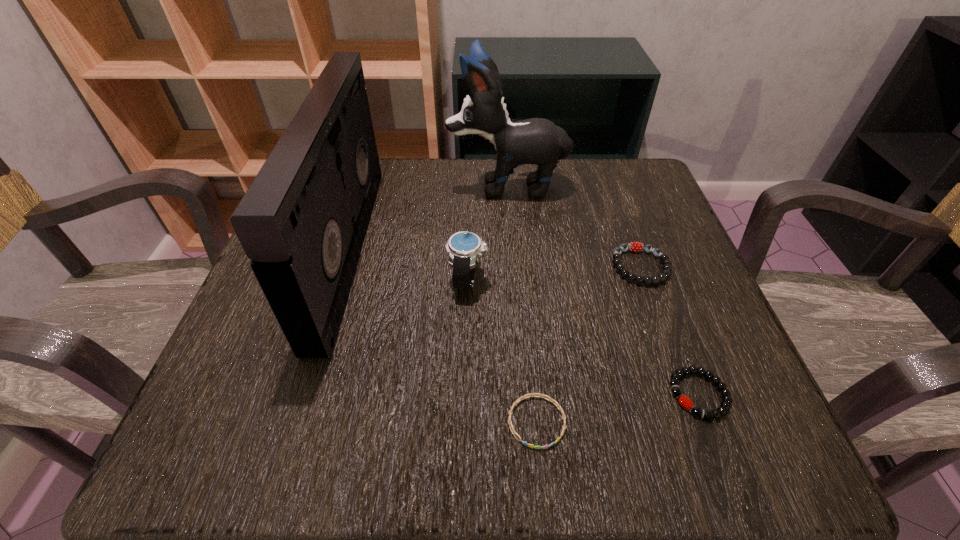
Image resolution: width=960 pixels, height=540 pixels. I want to click on free space between the puppy and the videotape, so click(428, 218).

Locate an element on the screen. Image resolution: width=960 pixels, height=540 pixels. free space between the puppy and the watch is located at coordinates (488, 232).

This screenshot has height=540, width=960. I want to click on free space between the watch and the shortest object, so (x=502, y=350).

Where is `vacant space that is in between the tallest bracelet and the watch`? The image size is (960, 540). vacant space that is in between the tallest bracelet and the watch is located at coordinates (554, 273).

At what (x,y) coordinates should I click in order to perform the action: click on unoccupied position between the tallest bracelet and the watch. Please return your answer as a coordinate pair (x, y). Looking at the image, I should click on (554, 273).

You are a GUI agent. You are given a task and a screenshot of the screen. Output one action in this format:
    pyautogui.click(x=<x>, y=<y>)
    Task: Click on the object that stands as the second closest to the videotape
    
    Given the screenshot: What is the action you would take?
    pyautogui.click(x=463, y=248)

Identify the location of object that is the third nearest to the farthest bracelet. (463, 248).

Select which bracelet appears as the second closest to the second shortest object. Please provide its 2D coordinates. Your answer should be formatted as a tuple, i.e. [(x, y)], where the tuple contains the x and y coordinates of a point satisfying the conditions above.

[(664, 258)]

Where is `bracelet that is the second closest to the leftmost bracelet`? bracelet that is the second closest to the leftmost bracelet is located at coordinates (664, 258).

The height and width of the screenshot is (540, 960). Find the location of `vacant region that satisfies the following two spatial constraints: 1. on the front side of the second shortest object; 2. on the right side of the leftmost object`. vacant region that satisfies the following two spatial constraints: 1. on the front side of the second shortest object; 2. on the right side of the leftmost object is located at coordinates (304, 394).